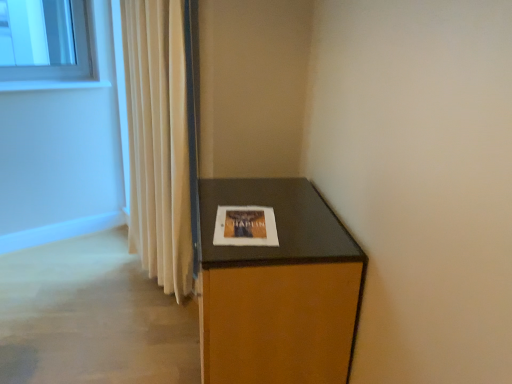
Image resolution: width=512 pixels, height=384 pixels. What are the coordinates of `vacant location below beige fabric curtain at left (from a real-world perspective)` in the screenshot? It's located at (159, 295).